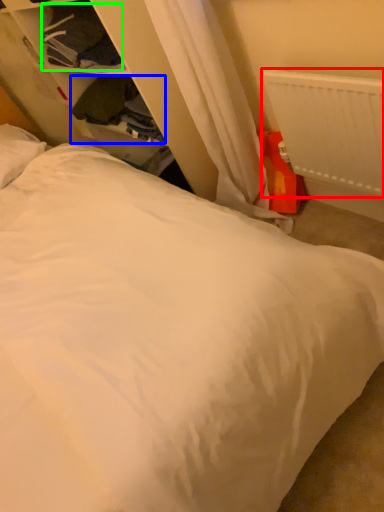
Question: Which object is the closest to the radiator (highlighted by a red box)? Choose among these: clothing (highlighted by a blue box) or clothing (highlighted by a green box).

Choices:
 (A) clothing
 (B) clothing

Answer: (A)